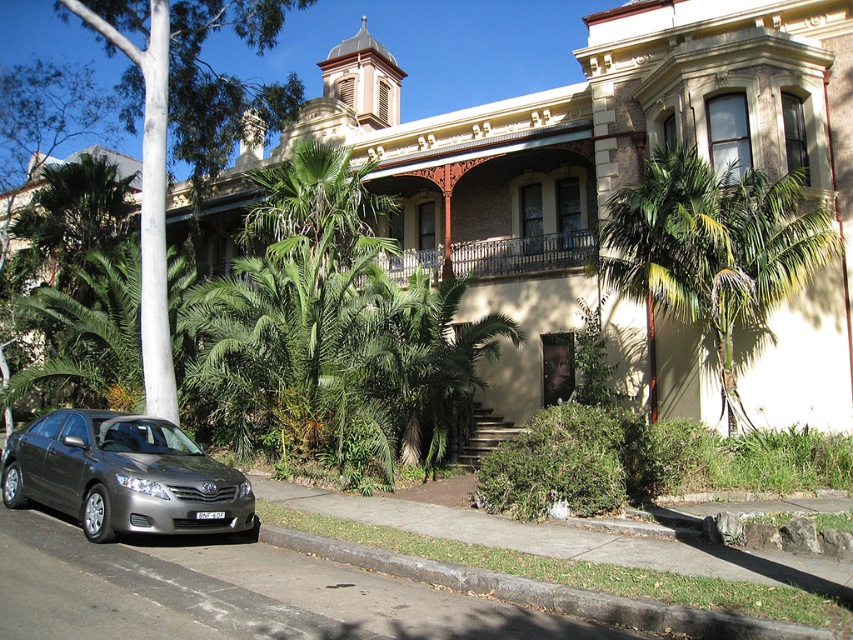
You are standing in front of the grand historic building and want to park your car. The green leafy tree at center and the satin silver sedan at lower left are already present. Which side of the tree should you park your car to avoid blocking the view of the building?

You should park your car to the right side of the green leafy tree at center because the satin silver sedan at lower left is already parked to its left, so parking on the right would keep the view of the building clear.

You are a gardener planning to trim the green leafy palm tree at center and the gray concrete curb at lower center. Which object is located above the other?

The green leafy palm tree at center is positioned over the gray concrete curb at lower center, so the palm tree is above the curb.

In the scene shown: You are standing at the front entrance of the grand historic building and see the point marked at coordinate (712, 257). What object is located at that point?

The point at coordinate (712, 257) corresponds to the green leafy palm tree at center.